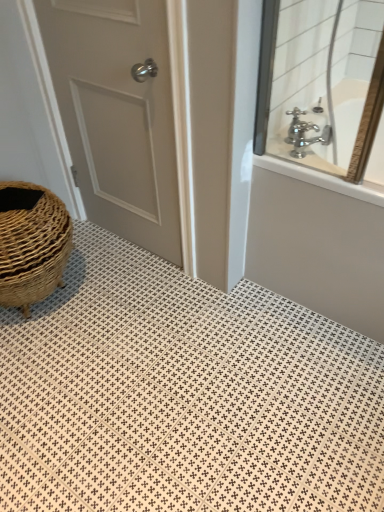
The image size is (384, 512). What do you see at coordinates (323, 81) in the screenshot?
I see `polished chrome faucet at upper right` at bounding box center [323, 81].

At what (x,y) coordinates should I click in order to perform the action: click on chrome metallic faucet at upper right. Please return your answer as a coordinate pair (x, y). This screenshot has width=384, height=512. Looking at the image, I should click on (304, 134).

From the image's perspective, is silver metallic faucet at upper right above or below white textured tile at lower left?

silver metallic faucet at upper right is above white textured tile at lower left.

Does silver metallic faucet at upper right have a lesser width compared to white textured tile at lower left?

Correct, the width of silver metallic faucet at upper right is less than that of white textured tile at lower left.

Which of these two, silver metallic faucet at upper right or white textured tile at lower left, is smaller?

silver metallic faucet at upper right.

Is polished chrome faucet at upper right not within chrome metallic faucet at upper right?

Absolutely, polished chrome faucet at upper right is external to chrome metallic faucet at upper right.

Looking at this image, considering the relative sizes of polished chrome faucet at upper right and chrome metallic faucet at upper right in the image provided, is polished chrome faucet at upper right thinner than chrome metallic faucet at upper right?

No.

Considering the relative sizes of polished chrome faucet at upper right and chrome metallic faucet at upper right in the image provided, is polished chrome faucet at upper right taller than chrome metallic faucet at upper right?

Yes.

In the scene shown: Is polished chrome faucet at upper right not close to chrome metallic faucet at upper right?

polished chrome faucet at upper right is actually quite close to chrome metallic faucet at upper right.

Considering the positions of objects white textured tile at lower left and white matte door at left in the image provided, who is more to the right, white textured tile at lower left or white matte door at left?

From the viewer's perspective, white textured tile at lower left appears more on the right side.

Does point (153, 339) come behind point (48, 52)?

No, (153, 339) is in front of (48, 52).

Consider the image. Measure the distance from white textured tile at lower left to white matte door at left.

white textured tile at lower left is 60.04 centimeters from white matte door at left.

Which object is thinner, white textured tile at lower left or white matte door at left?

Thinner between the two is white matte door at left.

Considering the relative sizes of silver metallic faucet at upper right and chrome metallic faucet at upper right in the image provided, is silver metallic faucet at upper right thinner than chrome metallic faucet at upper right?

In fact, silver metallic faucet at upper right might be wider than chrome metallic faucet at upper right.

Can you confirm if silver metallic faucet at upper right is bigger than chrome metallic faucet at upper right?

No, silver metallic faucet at upper right is not bigger than chrome metallic faucet at upper right.

Which point is more distant from viewer, (299, 153) or (297, 137)?

Point (297, 137)

From the image's perspective, is silver metallic faucet at upper right above or below chrome metallic faucet at upper right?

From the image's perspective, silver metallic faucet at upper right appears above chrome metallic faucet at upper right.

Does point (220, 314) lie behind point (310, 129)?

That is True.

Consider the image. Can you confirm if white textured tile at lower left is shorter than chrome metallic faucet at upper right?

Yes.

Can you confirm if white textured tile at lower left is positioned to the right of chrome metallic faucet at upper right?

Incorrect, white textured tile at lower left is not on the right side of chrome metallic faucet at upper right.

Is chrome metallic faucet at upper right at the back of white textured tile at lower left?

That's not correct — white textured tile at lower left is not looking away from chrome metallic faucet at upper right.

Is white matte door at left oriented away from chrome metallic faucet at upper right?

No.

Can you tell me how much white matte door at left and chrome metallic faucet at upper right differ in facing direction?

123 degrees.

From the picture: From a real-world perspective, is white matte door at left physically below chrome metallic faucet at upper right?

Indeed, from a real-world perspective, white matte door at left is positioned beneath chrome metallic faucet at upper right.

Consider the image. Is chrome metallic faucet at upper right facing towards white matte door at left?

No, chrome metallic faucet at upper right is not facing towards white matte door at left.

Consider the image. Which is in front, chrome metallic faucet at upper right or white matte door at left?

Positioned in front is white matte door at left.

This screenshot has width=384, height=512. I want to click on door on the left side of chrome metallic faucet at upper right, so click(x=117, y=114).

Find the location of a particular element. Image resolution: width=384 pixels, height=512 pixels. tap positioned vertically above the white textured tile at lower left (from a real-world perspective) is located at coordinates (305, 133).

You are a GUI agent. You are given a task and a screenshot of the screen. Output one action in this format:
    pyautogui.click(x=<x>, y=<y>)
    Task: Click on the faucet located below the polished chrome faucet at upper right (from the image's perspective)
    
    Given the screenshot: What is the action you would take?
    pyautogui.click(x=304, y=134)

When comparing their distances from silver metallic faucet at upper right, does white textured tile at lower left or polished chrome faucet at upper right seem further?

white textured tile at lower left is positioned further to the anchor silver metallic faucet at upper right.

Based on their spatial positions, is white textured tile at lower left or white matte door at left closer to silver metallic faucet at upper right?

Based on the image, white matte door at left appears to be nearer to silver metallic faucet at upper right.

Estimate the real-world distances between objects in this image. Which object is further from polished chrome faucet at upper right, white textured tile at lower left or chrome metallic faucet at upper right?

Among the two, white textured tile at lower left is located further to polished chrome faucet at upper right.

When comparing their distances from chrome metallic faucet at upper right, does white matte door at left or polished chrome faucet at upper right seem further?

Among the two, white matte door at left is located further to chrome metallic faucet at upper right.

Which object lies further to the anchor point silver metallic faucet at upper right, polished chrome faucet at upper right or white matte door at left?

Among the two, white matte door at left is located further to silver metallic faucet at upper right.

From the image, which object appears to be farther from silver metallic faucet at upper right, white textured tile at lower left or chrome metallic faucet at upper right?

The object further to silver metallic faucet at upper right is white textured tile at lower left.

From the picture: When comparing their distances from white textured tile at lower left, does polished chrome faucet at upper right or silver metallic faucet at upper right seem closer?

The object closer to white textured tile at lower left is polished chrome faucet at upper right.

Which object lies nearer to the anchor point polished chrome faucet at upper right, white matte door at left or chrome metallic faucet at upper right?

chrome metallic faucet at upper right.

This screenshot has height=512, width=384. I want to click on faucet between white matte door at left and polished chrome faucet at upper right from left to right, so click(x=304, y=134).

You are a GUI agent. You are given a task and a screenshot of the screen. Output one action in this format:
    pyautogui.click(x=<x>, y=<y>)
    Task: Click on the tap between polished chrome faucet at upper right and white textured tile at lower left in the vertical direction
    Image resolution: width=384 pixels, height=512 pixels.
    Given the screenshot: What is the action you would take?
    pyautogui.click(x=305, y=133)

Locate an element on the screen. The image size is (384, 512). door that lies between polished chrome faucet at upper right and white textured tile at lower left from top to bottom is located at coordinates (117, 114).

Find the location of a particular element. tap located between white matte door at left and polished chrome faucet at upper right in the left-right direction is located at coordinates (305, 133).